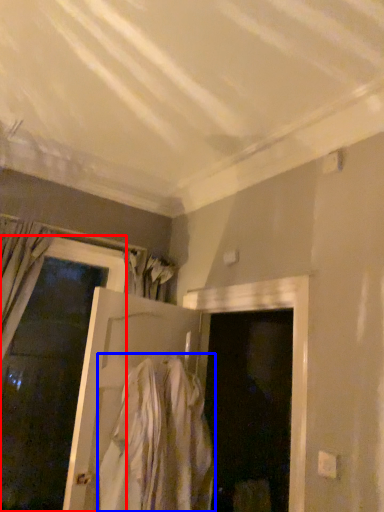
Question: Among these objects, which one is nearest to the camera, door (highlighted by a red box) or clothing (highlighted by a blue box)?

Choices:
 (A) door
 (B) clothing

Answer: (B)